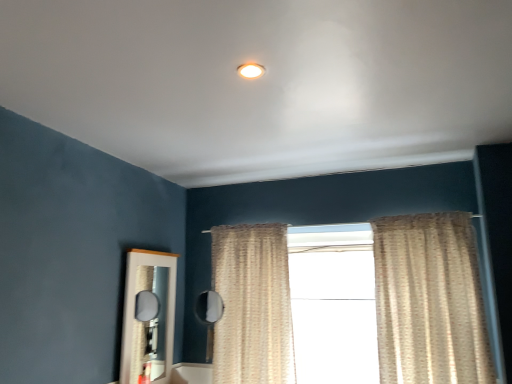
Question: Can you confirm if white glossy mirror at lower left is shorter than matte white light fixture at upper center?

Choices:
 (A) yes
 (B) no

Answer: (B)

Question: From the image's perspective, is white glossy mirror at lower left beneath matte white light fixture at upper center?

Choices:
 (A) no
 (B) yes

Answer: (B)

Question: Is white glossy mirror at lower left facing towards matte white light fixture at upper center?

Choices:
 (A) yes
 (B) no

Answer: (B)

Question: From a real-world perspective, is white glossy mirror at lower left under matte white light fixture at upper center?

Choices:
 (A) no
 (B) yes

Answer: (B)

Question: Does white glossy mirror at lower left have a greater height compared to matte white light fixture at upper center?

Choices:
 (A) yes
 (B) no

Answer: (A)

Question: From the image's perspective, is matte white light fixture at upper center above or below beige textured curtain at center, arranged as the first curtain when viewed from the left?

Choices:
 (A) below
 (B) above

Answer: (B)

Question: Considering their positions, is matte white light fixture at upper center located in front of or behind beige textured curtain at center, arranged as the first curtain when viewed from the left?

Choices:
 (A) front
 (B) behind

Answer: (A)

Question: Considering the positions of point (248, 72) and point (245, 225), is point (248, 72) closer or farther from the camera than point (245, 225)?

Choices:
 (A) closer
 (B) farther

Answer: (A)

Question: In terms of height, does matte white light fixture at upper center look taller or shorter compared to beige textured curtain at center, which appears as the 2th curtain when viewed from the right?

Choices:
 (A) tall
 (B) short

Answer: (B)

Question: Would you say beige textured curtain at center, arranged as the first curtain when viewed from the left, is inside or outside white glossy mirror at lower left?

Choices:
 (A) inside
 (B) outside

Answer: (B)

Question: Does point (257, 365) appear closer or farther from the camera than point (166, 307)?

Choices:
 (A) farther
 (B) closer

Answer: (B)

Question: In the image, is beige textured curtain at center, arranged as the first curtain when viewed from the left, positioned in front of or behind white glossy mirror at lower left?

Choices:
 (A) behind
 (B) front

Answer: (A)

Question: Considering the positions of beige textured curtain at center, which appears as the 2th curtain when viewed from the right, and white glossy mirror at lower left in the image, is beige textured curtain at center, which appears as the 2th curtain when viewed from the right, wider or thinner than white glossy mirror at lower left?

Choices:
 (A) thin
 (B) wide

Answer: (B)

Question: From a real-world perspective, relative to beige textured curtain at right, which is the 1th curtain from right to left, is white glossy mirror at lower left vertically above or below?

Choices:
 (A) above
 (B) below

Answer: (B)

Question: From their relative heights in the image, would you say white glossy mirror at lower left is taller or shorter than beige textured curtain at right, positioned as the 2th curtain in left-to-right order?

Choices:
 (A) short
 (B) tall

Answer: (A)